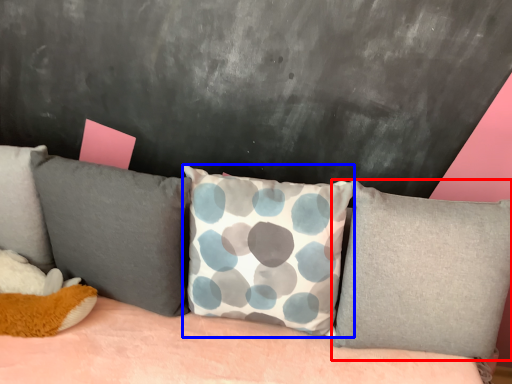
Question: Which of the following is the closest to the observer, pillow (highlighted by a red box) or pillow (highlighted by a blue box)?

Choices:
 (A) pillow
 (B) pillow

Answer: (B)